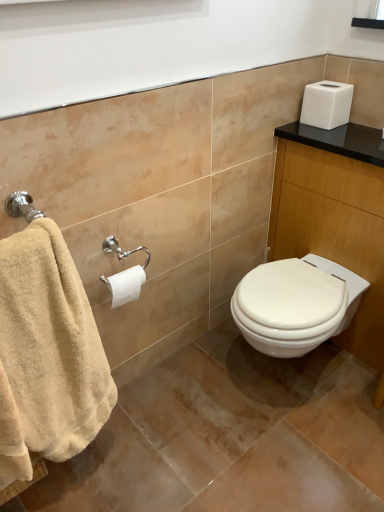
Question: Considering the relative sizes of beige cotton towel at left and white glossy vanity at upper right in the image provided, is beige cotton towel at left taller than white glossy vanity at upper right?

Choices:
 (A) no
 (B) yes

Answer: (A)

Question: Is beige cotton towel at left closer to the viewer compared to white glossy vanity at upper right?

Choices:
 (A) yes
 (B) no

Answer: (A)

Question: Is white glossy vanity at upper right located within beige cotton towel at left?

Choices:
 (A) yes
 (B) no

Answer: (B)

Question: From a real-world perspective, is beige cotton towel at left physically below white glossy vanity at upper right?

Choices:
 (A) yes
 (B) no

Answer: (B)

Question: Can you confirm if beige cotton towel at left is smaller than white glossy vanity at upper right?

Choices:
 (A) no
 (B) yes

Answer: (B)

Question: Is beige cotton towel at left bigger or smaller than white matte toilet paper at center left?

Choices:
 (A) small
 (B) big

Answer: (B)

Question: From the image's perspective, is beige cotton towel at left positioned above or below white matte toilet paper at center left?

Choices:
 (A) below
 (B) above

Answer: (A)

Question: Would you say beige cotton towel at left is inside or outside white matte toilet paper at center left?

Choices:
 (A) outside
 (B) inside

Answer: (A)

Question: Looking at their shapes, would you say beige cotton towel at left is wider or thinner than white matte toilet paper at center left?

Choices:
 (A) wide
 (B) thin

Answer: (A)

Question: In terms of width, does beige cotton towel at left look wider or thinner when compared to white glossy vanity at upper right?

Choices:
 (A) thin
 (B) wide

Answer: (A)

Question: From a real-world perspective, relative to white glossy vanity at upper right, is beige cotton towel at left vertically above or below?

Choices:
 (A) above
 (B) below

Answer: (A)

Question: In the image, is beige cotton towel at left positioned in front of or behind white glossy vanity at upper right?

Choices:
 (A) behind
 (B) front

Answer: (B)

Question: Is point (31, 450) closer or farther from the camera than point (372, 256)?

Choices:
 (A) closer
 (B) farther

Answer: (A)

Question: From a real-world perspective, relative to white matte toilet paper at center left, is white glossy vanity at upper right vertically above or below?

Choices:
 (A) above
 (B) below

Answer: (B)

Question: Relative to white matte toilet paper at center left, is white glossy vanity at upper right in front or behind?

Choices:
 (A) front
 (B) behind

Answer: (A)